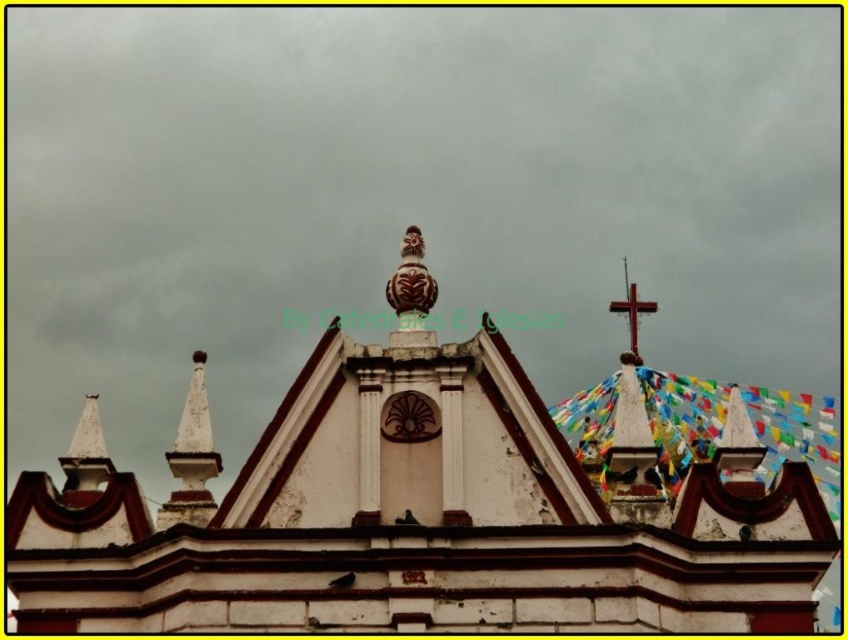
Looking at this image, does white painted stone church at center have a greater height compared to wooden cross at upper right?

Yes.

Is point (506, 602) behind point (637, 321)?

No, it is not.

Image resolution: width=848 pixels, height=640 pixels. I want to click on white painted stone church at center, so click(x=408, y=513).